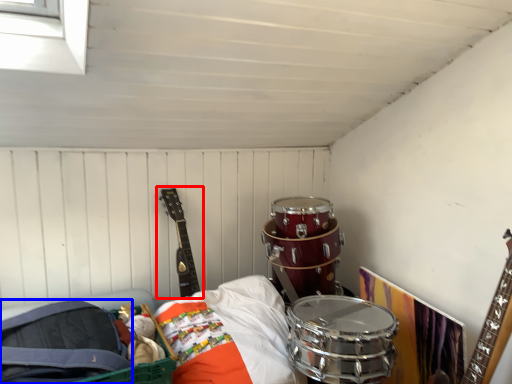
Question: Which object is further to the camera taking this photo, guitar (highlighted by a red box) or drum (highlighted by a blue box)?

Choices:
 (A) guitar
 (B) drum

Answer: (A)